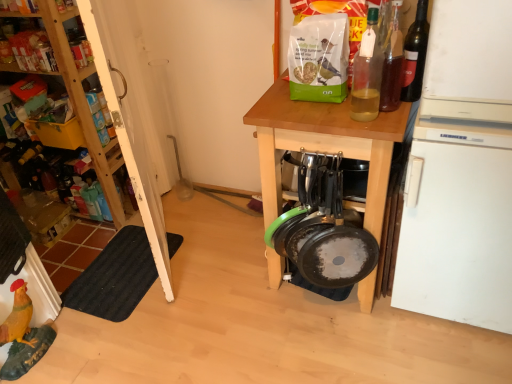
What are the coordinates of `vacant space to the left of translucent glass bottle at upper right, the 3th bottle in the right-to-left sequence` in the screenshot? It's located at (316, 117).